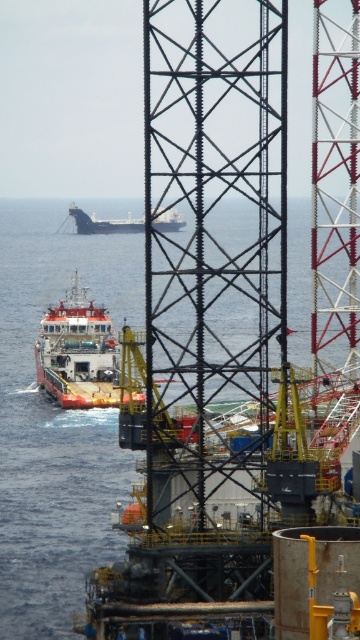
Question: Is blue water at center thinner than white matte ship at center?

Choices:
 (A) no
 (B) yes

Answer: (A)

Question: Is blue water at center behind white matte cargo ship at center?

Choices:
 (A) no
 (B) yes

Answer: (B)

Question: Among these objects, which one is nearest to the camera?

Choices:
 (A) white matte cargo ship at center
 (B) blue water at center

Answer: (A)

Question: Is blue water at center bigger than white matte cargo ship at center?

Choices:
 (A) yes
 (B) no

Answer: (A)

Question: Which of the following is the farthest from the observer?

Choices:
 (A) blue water at center
 (B) white matte ship at center
 (C) white matte cargo ship at center

Answer: (B)

Question: Which object is the closest to the white matte ship at center?

Choices:
 (A) white matte cargo ship at center
 (B) blue water at center

Answer: (B)